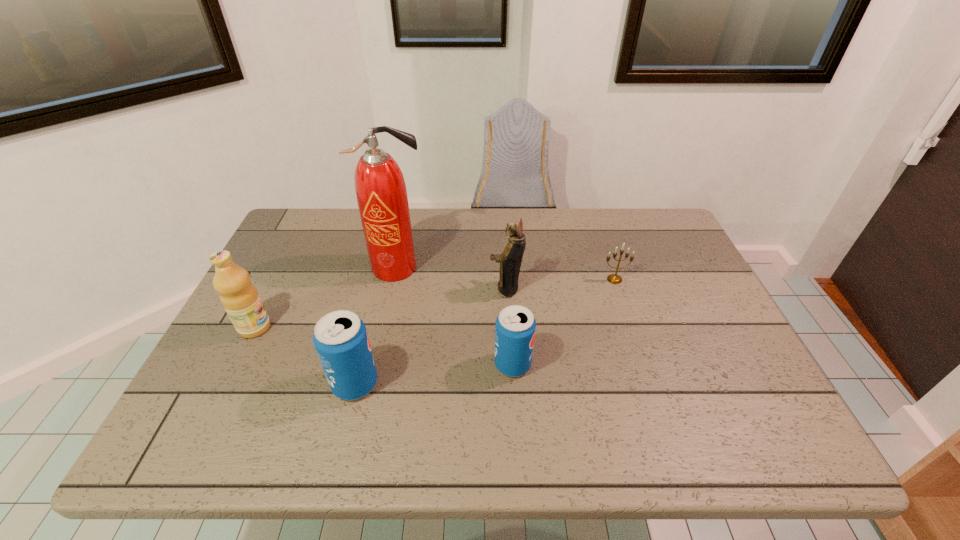
What are the coordinates of `free space located on the back of the taller soda can` in the screenshot? It's located at (382, 273).

This screenshot has height=540, width=960. What are the coordinates of `free space located 0.050m on the right of the fifth tallest object` in the screenshot? It's located at (553, 364).

What are the coordinates of `free space located 0.120m on the front of the tallest object` in the screenshot? It's located at (388, 314).

Where is `free space located on the front of the rightmost object`? The image size is (960, 540). free space located on the front of the rightmost object is located at coordinates pos(622,302).

The image size is (960, 540). Identify the location of free space located 0.080m on the label of the olive oil. (302, 328).

Where is `free location located 0.360m on the front-facing side of the figurine`? free location located 0.360m on the front-facing side of the figurine is located at coordinates (358, 288).

Locate an element on the screen. The height and width of the screenshot is (540, 960). vacant region located 0.100m on the front-facing side of the figurine is located at coordinates point(452,288).

Locate an element on the screen. The height and width of the screenshot is (540, 960). free space located 0.370m on the front-facing side of the figurine is located at coordinates (354, 288).

Locate an element on the screen. object that is at the left edge is located at coordinates (240, 298).

Locate an element on the screen. The height and width of the screenshot is (540, 960). free space at the far edge is located at coordinates (553, 217).